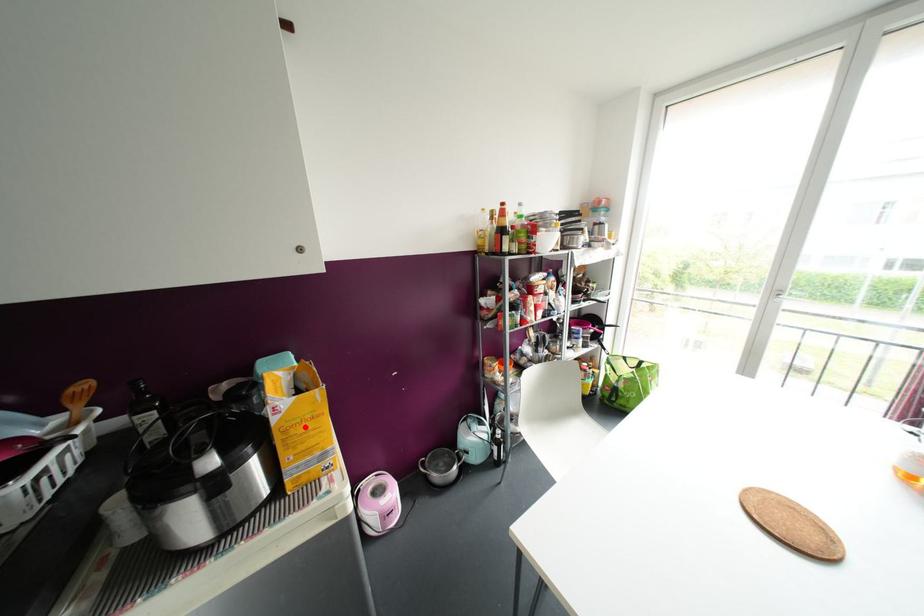
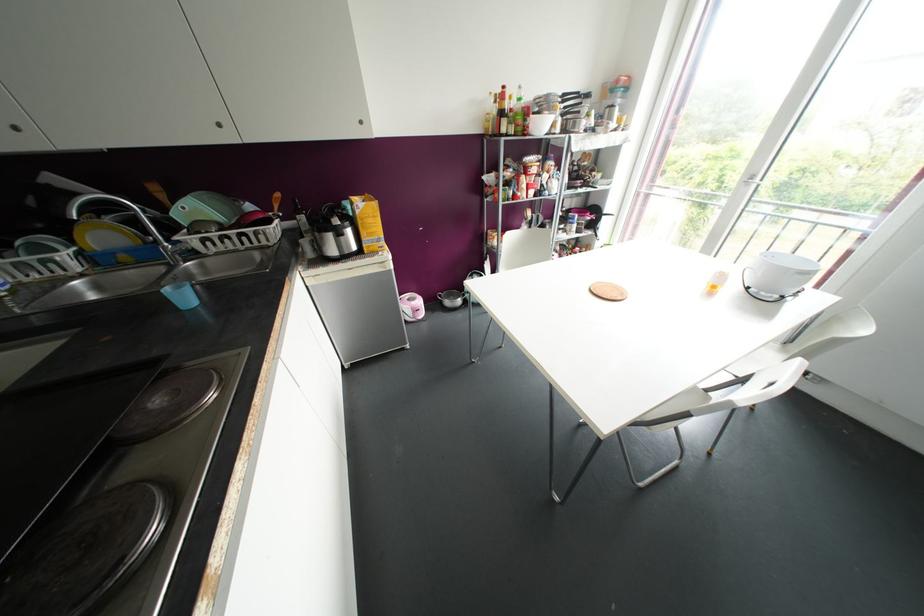
Locate, in the second image, the point that corresponds to the highlighted location in the first image.

(370, 220)